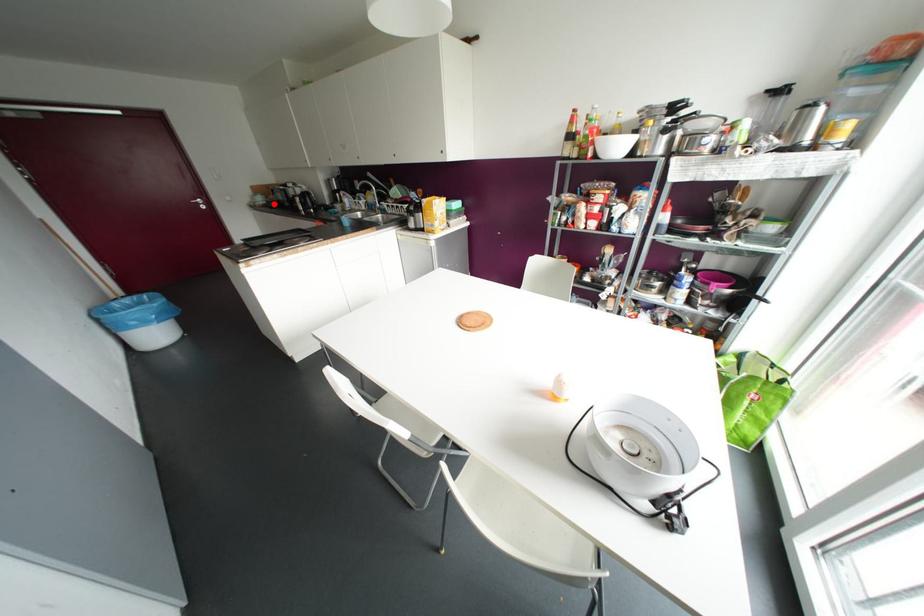
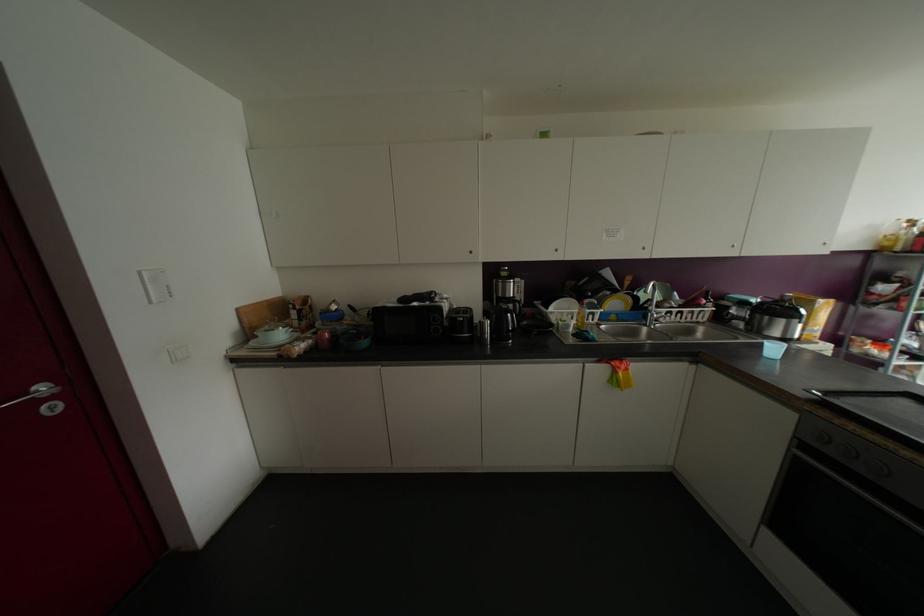
Find the pixel in the second image that matches the highlighted location in the first image.

(363, 342)